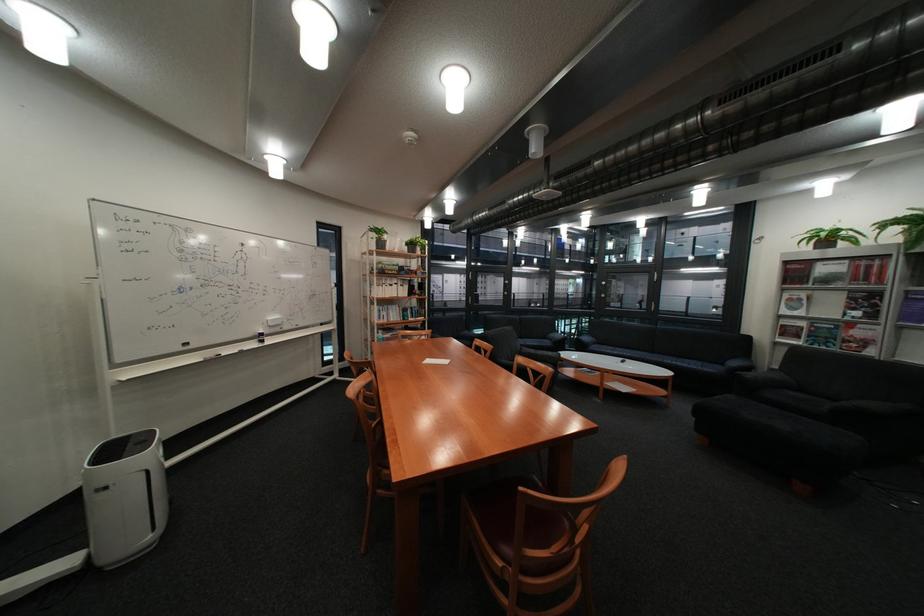
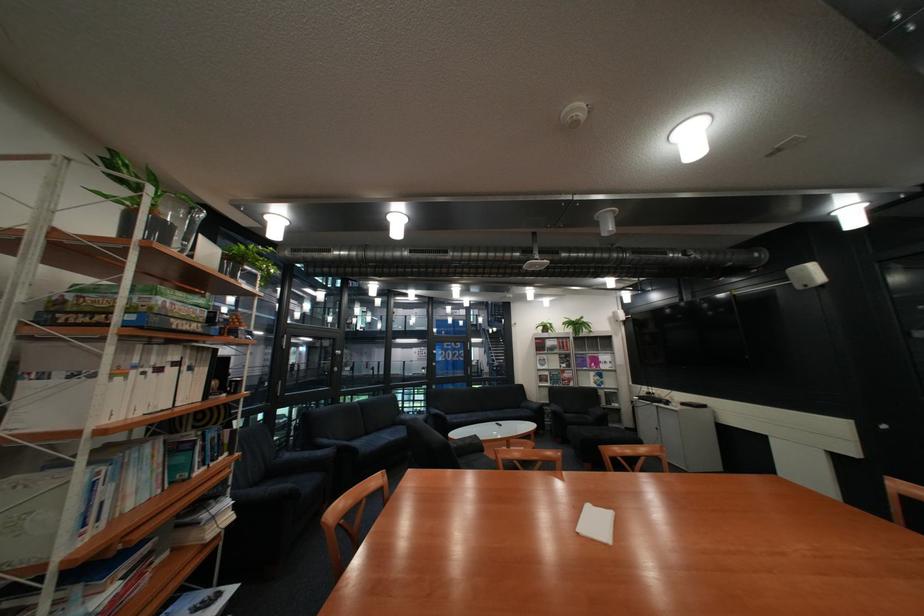
Locate, in the second image, the point that corresponds to point 737,363 in the first image.

(535, 408)